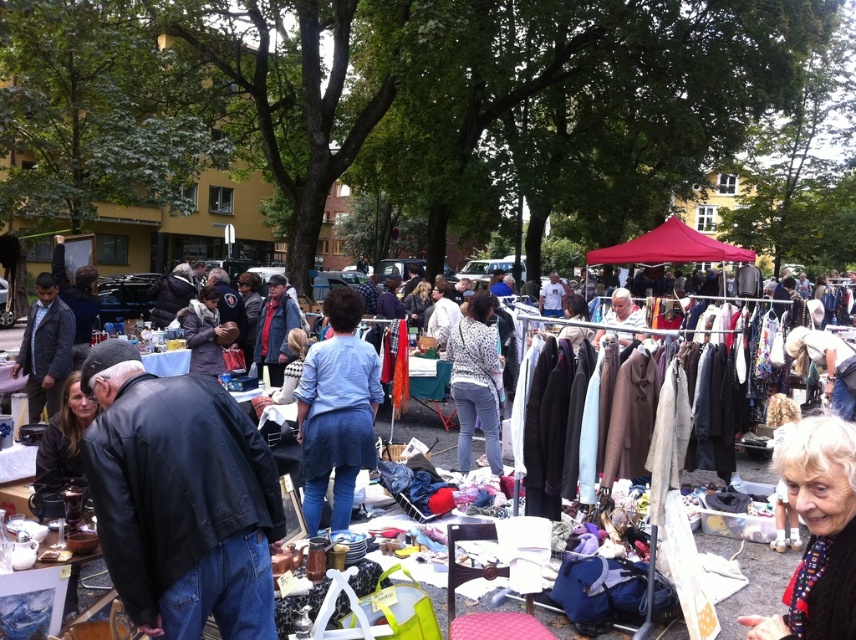
Does matte black jacket at lower left have a smaller size compared to brown fuzzy coat at center?

Correct, matte black jacket at lower left occupies less space than brown fuzzy coat at center.

Can you confirm if matte black jacket at lower left is positioned to the right of brown fuzzy coat at center?

Correct, you'll find matte black jacket at lower left to the right of brown fuzzy coat at center.

The height and width of the screenshot is (640, 856). What do you see at coordinates (61, 449) in the screenshot?
I see `matte black jacket at lower left` at bounding box center [61, 449].

Locate an element on the screen. This screenshot has width=856, height=640. matte black jacket at lower left is located at coordinates (61, 449).

Between point (111, 436) and point (183, 312), which one is positioned in front?

Point (111, 436) is more forward.

Is black leather jacket at lower left to the right of brown fuzzy coat at center from the viewer's perspective?

Indeed, black leather jacket at lower left is positioned on the right side of brown fuzzy coat at center.

I want to click on black leather jacket at lower left, so click(180, 499).

The height and width of the screenshot is (640, 856). What do you see at coordinates (756, 586) in the screenshot?
I see `textured fabric clothing at center` at bounding box center [756, 586].

Which is in front, point (746, 476) or point (663, 228)?

Point (746, 476) is more forward.

Locate an element on the screen. This screenshot has width=856, height=640. textured fabric clothing at center is located at coordinates (756, 586).